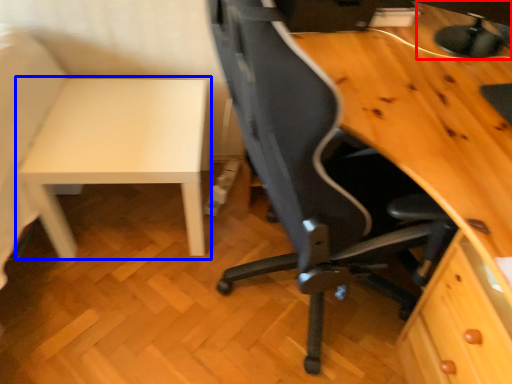
Question: Which of the following is the farthest to the observer, computer monitor (highlighted by a red box) or table (highlighted by a blue box)?

Choices:
 (A) computer monitor
 (B) table

Answer: (B)